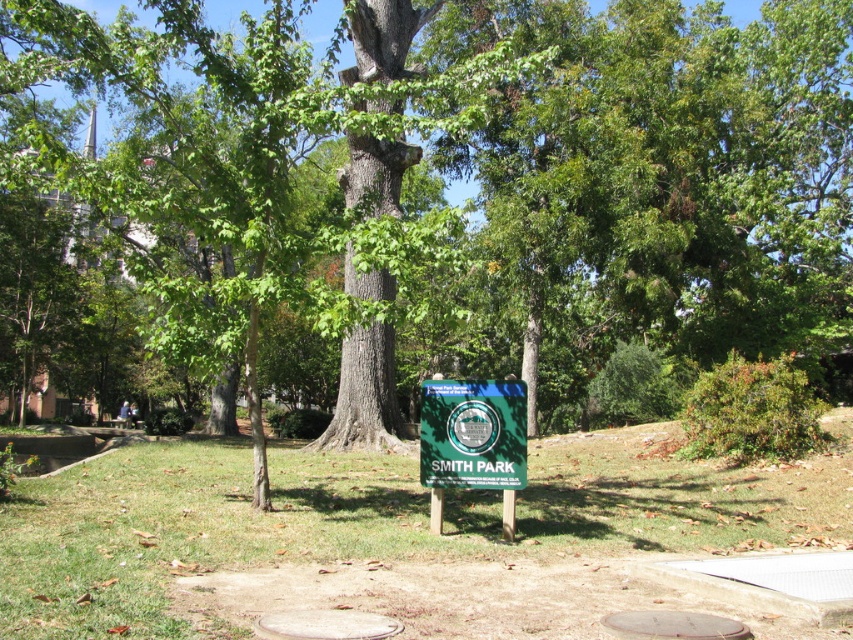
Consider the image. Which of these two, green grass at center or green plastic sign at center, stands shorter?

Standing shorter between the two is green plastic sign at center.

Who is taller, green grass at center or green plastic sign at center?

green grass at center is taller.

Image resolution: width=853 pixels, height=640 pixels. Identify the location of green grass at center. (376, 518).